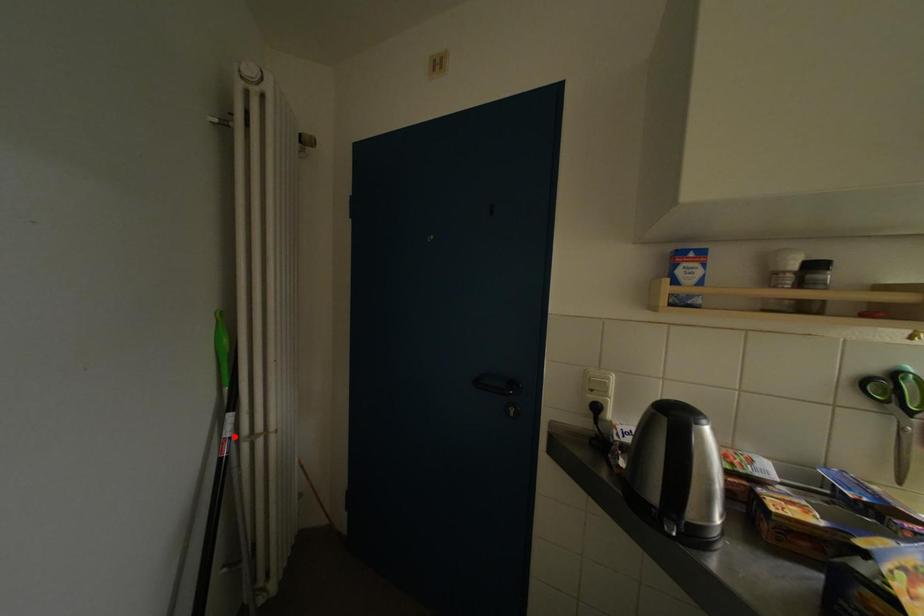
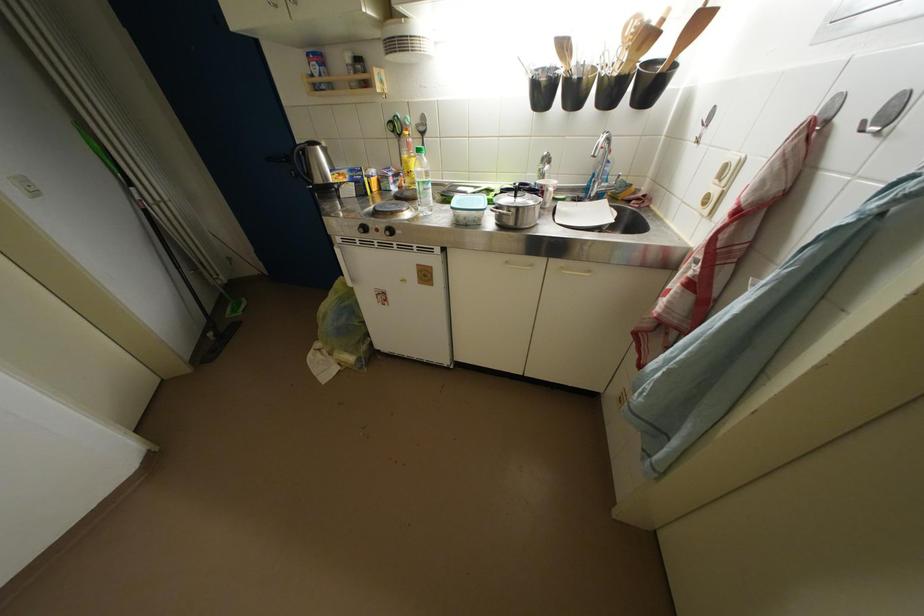
The point at the highlighted location is marked in the first image. Where is the corresponding point in the second image?

(144, 201)